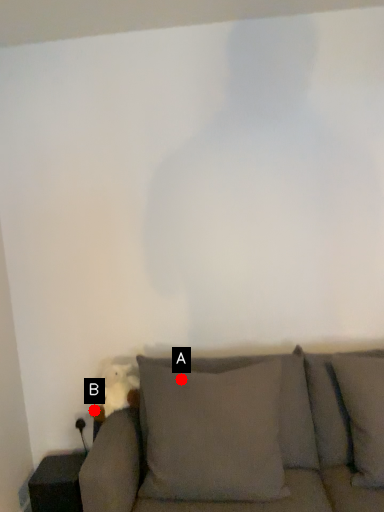
Question: Two points are circled on the image, labeled by A and B beside each circle. Which point appears closest to the camera in this image?

Choices:
 (A) A is closer
 (B) B is closer

Answer: (A)